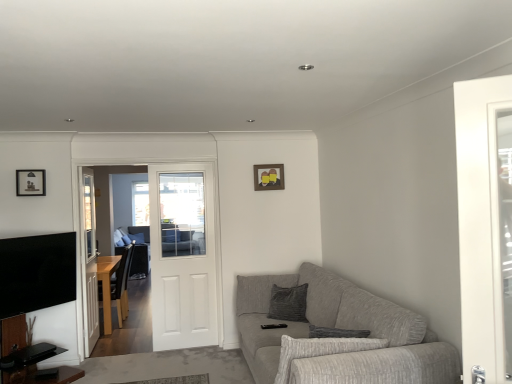
Question: Is black glossy tv at left thinner than gray fabric couch at center?

Choices:
 (A) no
 (B) yes

Answer: (B)

Question: Does black glossy tv at left have a smaller size compared to gray fabric couch at center?

Choices:
 (A) no
 (B) yes

Answer: (B)

Question: Is black glossy tv at left shorter than gray fabric couch at center?

Choices:
 (A) no
 (B) yes

Answer: (B)

Question: Is black glossy tv at left to the right of gray fabric couch at center from the viewer's perspective?

Choices:
 (A) no
 (B) yes

Answer: (B)

Question: Is black glossy tv at left in front of gray fabric couch at center?

Choices:
 (A) yes
 (B) no

Answer: (A)

Question: Does black glossy tv at left have a larger size compared to gray fabric couch at center?

Choices:
 (A) no
 (B) yes

Answer: (A)

Question: Is textured gray couch at lower right taller than clear glass door at left?

Choices:
 (A) yes
 (B) no

Answer: (B)

Question: Considering the relative sizes of textured gray couch at lower right and clear glass door at left in the image provided, is textured gray couch at lower right bigger than clear glass door at left?

Choices:
 (A) no
 (B) yes

Answer: (B)

Question: From the image's perspective, is textured gray couch at lower right on top of clear glass door at left?

Choices:
 (A) no
 (B) yes

Answer: (A)

Question: Can you confirm if textured gray couch at lower right is positioned to the right of clear glass door at left?

Choices:
 (A) no
 (B) yes

Answer: (B)

Question: Is textured gray couch at lower right looking in the opposite direction of clear glass door at left?

Choices:
 (A) no
 (B) yes

Answer: (A)

Question: Is clear glass door at left located within textured gray couch at lower right?

Choices:
 (A) no
 (B) yes

Answer: (A)

Question: Does white wooden door at center have a lesser width compared to wooden photo frame at upper center, the second picture frame viewed from the front?

Choices:
 (A) no
 (B) yes

Answer: (A)